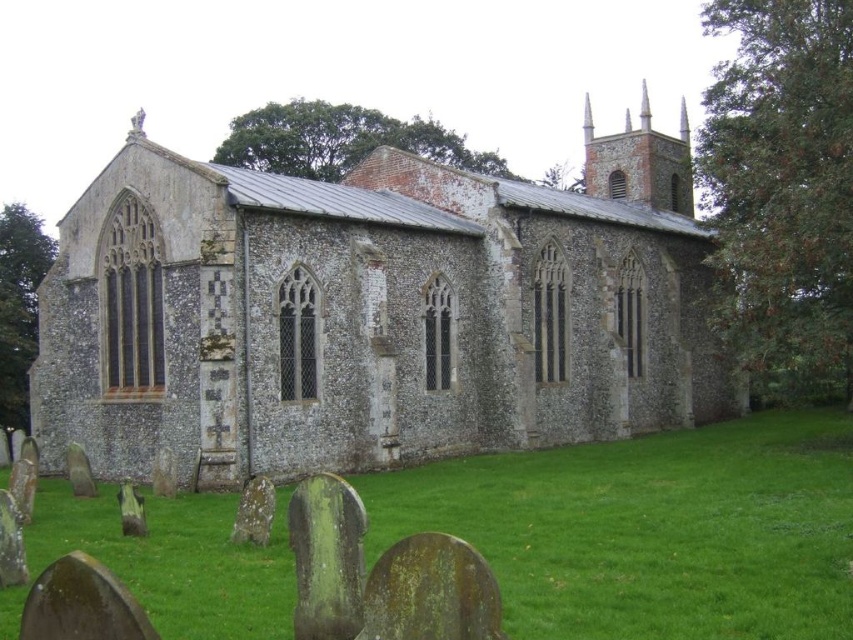
You are a visitor standing at the entrance of the speckled stone church at center. You want to walk to the green grass at lower center. Is the path clear of any large obstacles between them?

The speckled stone church at center is bigger than green grass at lower center, but the description does not mention any obstacles between them. Since the scene shows a neatly maintained grassy area with gravestones, the path is likely clear except for the gravestones themselves. However, the question specifies large obstacles, so unless the gravestones are considered large, the path is clear.

You are standing at the edge of the green grass at lower center, looking towards the speckled stone church at center. Which object is higher in elevation between the two?

The speckled stone church at center is taller than the green grass at lower center, so it is higher in elevation.